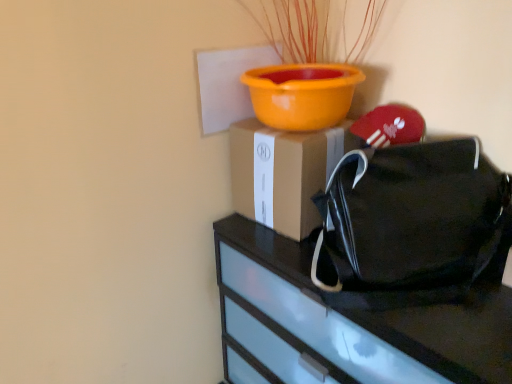
Question: From a real-world perspective, is black fabric handbag at right above or below brown cardboard box at center?

Choices:
 (A) below
 (B) above

Answer: (B)

Question: Considering the positions of black fabric handbag at right and brown cardboard box at center in the image, is black fabric handbag at right bigger or smaller than brown cardboard box at center?

Choices:
 (A) big
 (B) small

Answer: (A)

Question: Estimate the real-world distances between objects in this image. Which object is farther from the black fabric handbag at right?

Choices:
 (A) brown cardboard box at center
 (B) black matte bag at right

Answer: (A)

Question: Which is nearer to the brown cardboard box at center?

Choices:
 (A) black matte bag at right
 (B) black fabric handbag at right

Answer: (B)